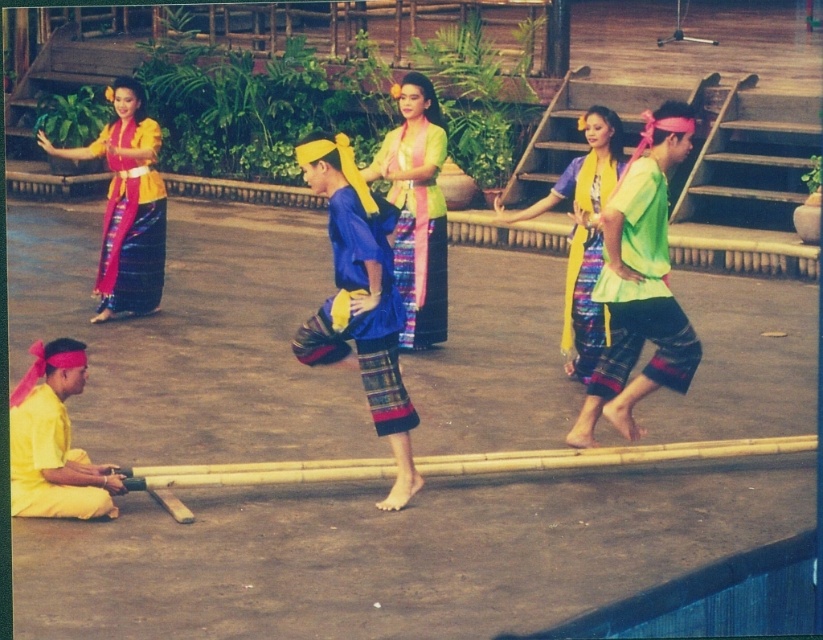
Question: Does matte green blouse at center appear on the left side of matte yellow shirt at lower left?

Choices:
 (A) no
 (B) yes

Answer: (A)

Question: Can you confirm if matte green blouse at center is positioned below matte yellow fabric at center?

Choices:
 (A) no
 (B) yes

Answer: (A)

Question: Which point is closer to the camera?

Choices:
 (A) matte yellow fabric skirt at left
 (B) yellow fabric skirt at center
 (C) green fabric skirt at center
 (D) matte green blouse at center

Answer: (C)

Question: Which point is farther to the camera?

Choices:
 (A) (107, 156)
 (B) (610, 168)
 (C) (82, 376)

Answer: (A)

Question: Can you confirm if blue woven skirt at center is wider than matte yellow fabric skirt at left?

Choices:
 (A) yes
 (B) no

Answer: (A)

Question: Which point appears farthest from the camera in this image?

Choices:
 (A) (129, 268)
 (B) (584, 332)

Answer: (A)